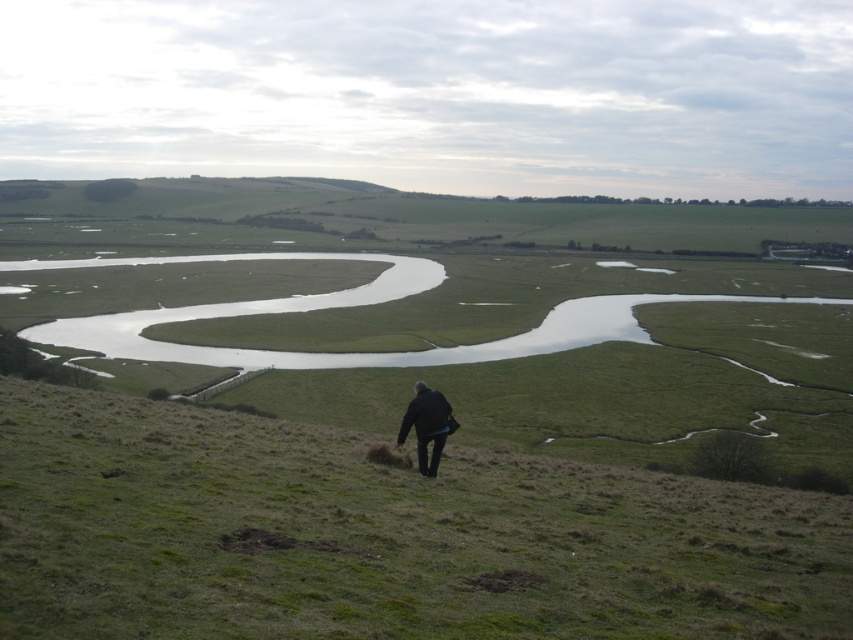
You are standing at the camera position and want to reach the river. Which direction should you walk relative to the green grassy hillside at lower center?

The green grassy hillside at lower center is located at point [381,536], so you should walk towards the lower right direction to reach the river.

You are a hiker standing at the top of the green grassy hillside at lower center and want to reach the black matte jacket at center. Which direction should you walk to get closer to the jacket?

The black matte jacket at center is located towards the bottom of the green grassy hillside at lower center, so you should walk downward towards the center to reach it.

You are a hiker standing on the green grassy hillside at lower center and want to reach the black matte jacket at center. Which direction should you move to get closer to the jacket?

The black matte jacket at center is located towards the center of the scene, so to reach it from the green grassy hillside at lower center, you should move upwards or towards the center direction.